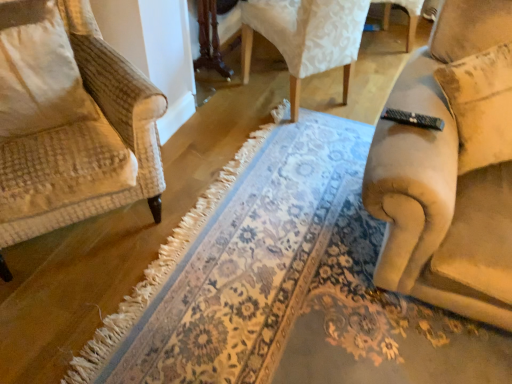
Question: Is beige fabric couch at right, arranged as the first chair when viewed from the front, situated inside floral carpet at center or outside?

Choices:
 (A) outside
 (B) inside

Answer: (A)

Question: Considering the positions of beige fabric couch at right, the second chair in the back-to-front sequence, and floral carpet at center in the image, is beige fabric couch at right, the second chair in the back-to-front sequence, taller or shorter than floral carpet at center?

Choices:
 (A) tall
 (B) short

Answer: (A)

Question: Considering the real-world distances, which object is closest to the beige fabric couch at right, arranged as the first chair when viewed from the front?

Choices:
 (A) floral carpet at center
 (B) velvet-like beige chair at upper center, which is the 2th chair in front-to-back order
 (C) beige textured pillow at left

Answer: (A)

Question: Which object is the closest to the velvet-like beige chair at upper center, which is the 2th chair in front-to-back order?

Choices:
 (A) beige fabric couch at right, the second chair in the back-to-front sequence
 (B) floral carpet at center
 (C) beige textured pillow at left

Answer: (B)